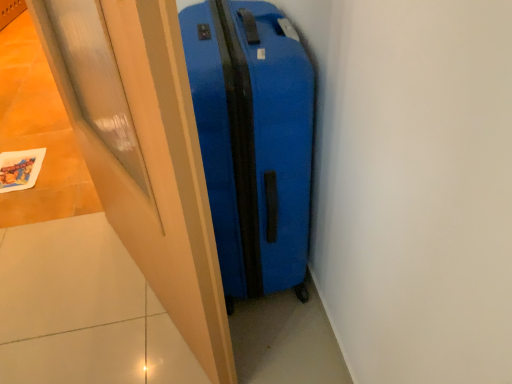
This screenshot has height=384, width=512. I want to click on free space below matte wood door at center (from a real-world perspective), so click(x=148, y=298).